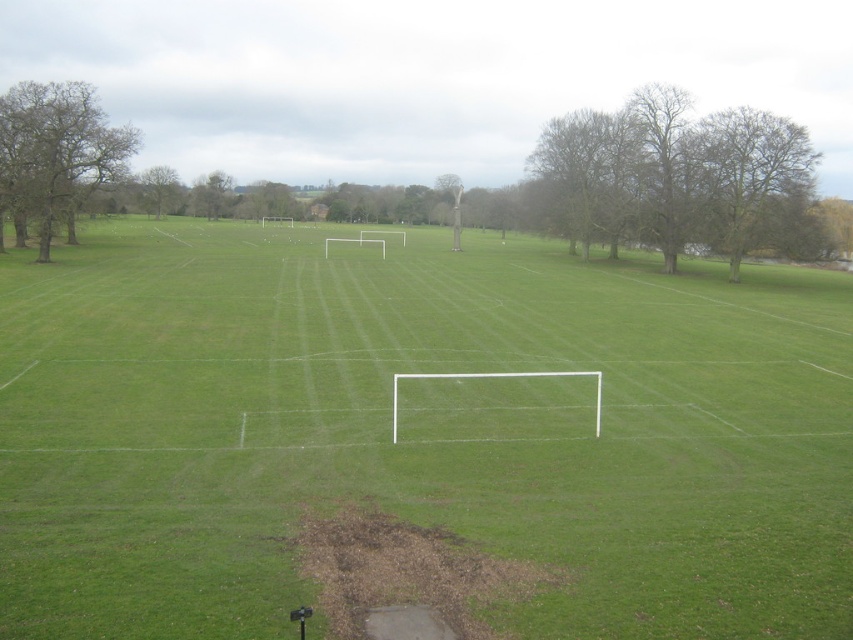
You are a soccer player standing at the edge of the field. You want to find the best spot to practice your kicks. According to the image, where is the green smooth grass at center located?

The green smooth grass at center is located at point (416, 429).

You are a photographer setting up a shot of the soccer field. You want to ensure both the brown leafless tree at upper right and the green leafy tree at upper left are visible in the frame. Based on their positions, which tree will appear closer to the camera?

The brown leafless tree at upper right appears closer to the camera because it is positioned in front of the green leafy tree at upper left.